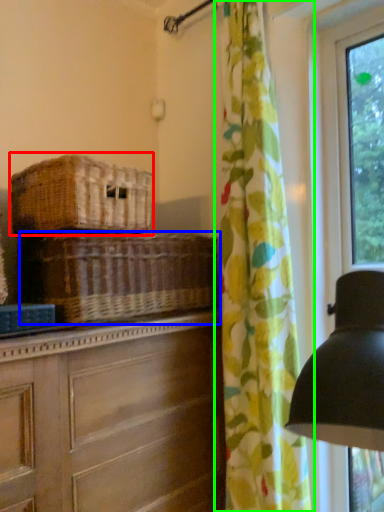
Question: Which object is the closest to the basket (highlighted by a red box)? Choose among these: basket (highlighted by a blue box) or curtain (highlighted by a green box).

Choices:
 (A) basket
 (B) curtain

Answer: (A)